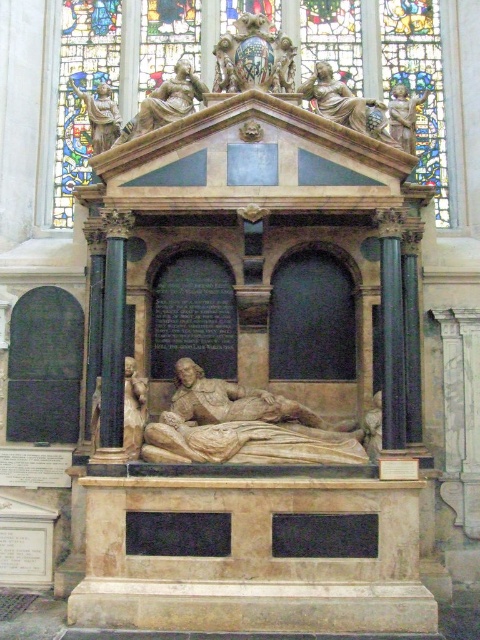
Who is more distant from viewer, (108, 304) or (319, 84)?

The point (319, 84) is more distant.

Is black marble column at left shorter than bronze statue at upper center?

In fact, black marble column at left may be taller than bronze statue at upper center.

Which is behind, point (111, 244) or point (322, 108)?

The point (322, 108) is behind.

At what (x,y) coordinates should I click in order to perform the action: click on black marble column at left. Please return your answer as a coordinate pair (x, y). This screenshot has width=480, height=640. Looking at the image, I should click on (112, 353).

Between stained glass window at upper center and polished marble statue at upper left, which one appears on the left side from the viewer's perspective?

polished marble statue at upper left

Is stained glass window at upper center above polished marble statue at upper left?

Yes, stained glass window at upper center is above polished marble statue at upper left.

Which is in front, point (188, 29) or point (94, 138)?

Point (94, 138)

The width and height of the screenshot is (480, 640). Identify the location of stained glass window at upper center. (82, 90).

Does polished marble statue at center have a larger size compared to matte stone statue at upper center?

Incorrect, polished marble statue at center is not larger than matte stone statue at upper center.

Which is more to the right, polished marble statue at center or matte stone statue at upper center?

Positioned to the right is polished marble statue at center.

I want to click on polished marble statue at center, so click(x=243, y=426).